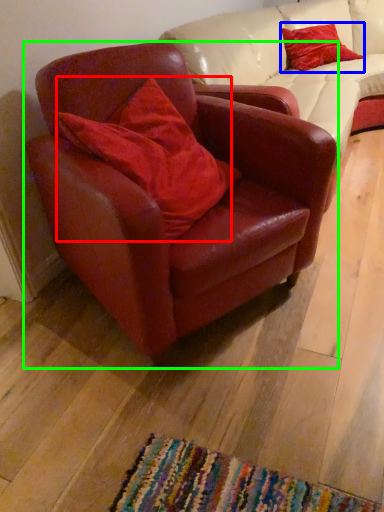
Question: Considering the real-world distances, which object is closest to pillow (highlighted by a red box)? pillow (highlighted by a blue box) or chair (highlighted by a green box).

Choices:
 (A) pillow
 (B) chair

Answer: (B)